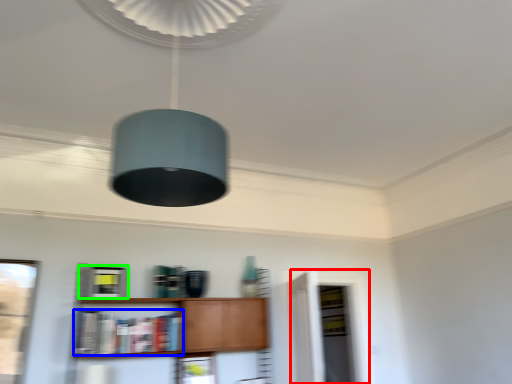
Question: Which object is positioned farthest from glass door (highlighted by a red box)? Select from book (highlighted by a blue box) and cabinetry (highlighted by a green box).

Choices:
 (A) book
 (B) cabinetry

Answer: (B)